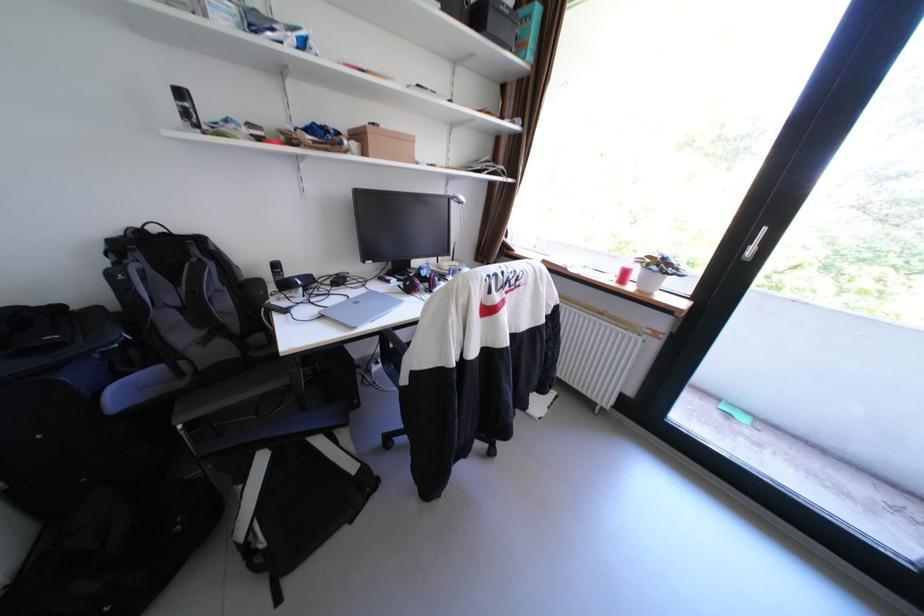
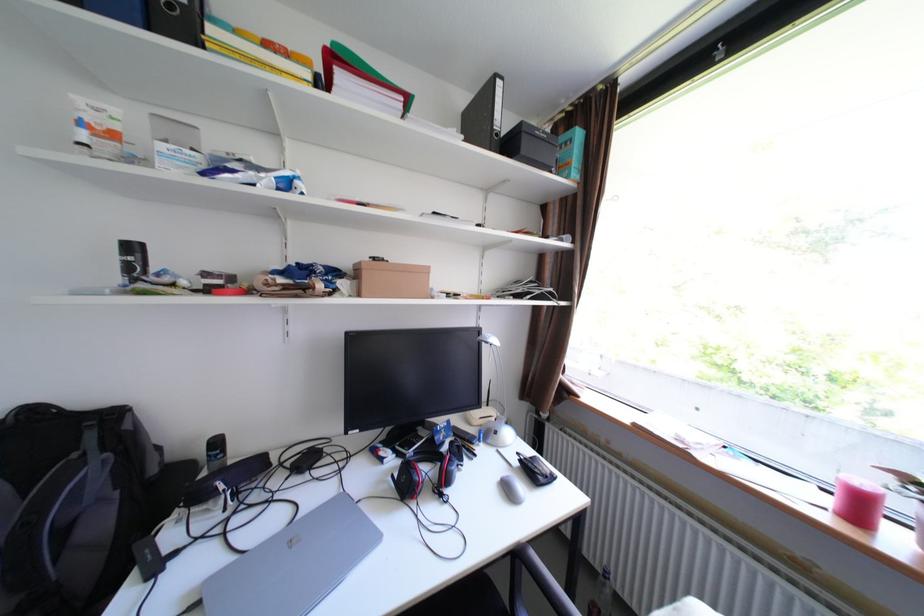
Question: Which direction would the cameraman need to move to produce the second image? Reply with the corresponding letter.

Choices:
 (A) Left
 (B) Right
 (C) Forward
 (D) Backward

Answer: (C)